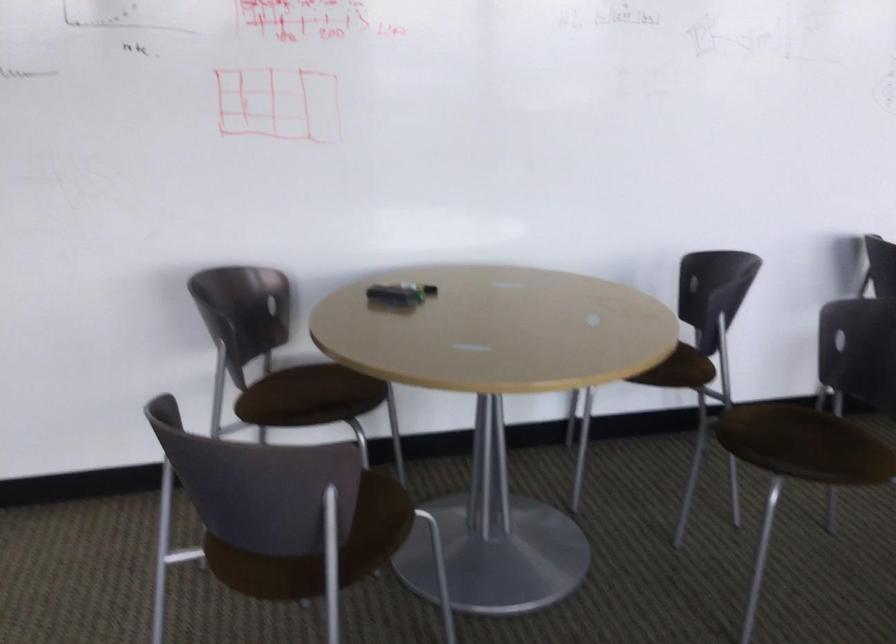
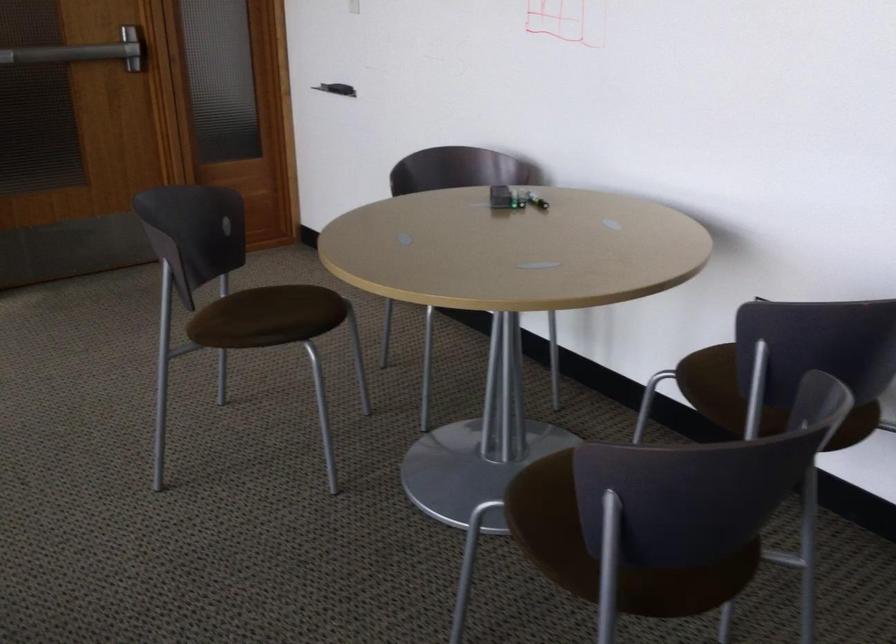
The point at (391,294) is marked in the first image. Where is the corresponding point in the second image?

(515, 196)